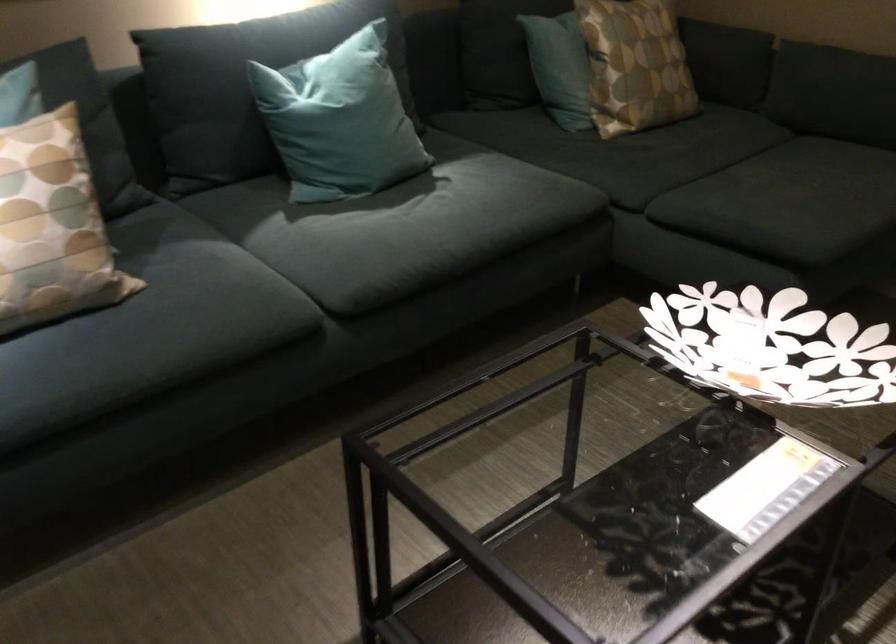
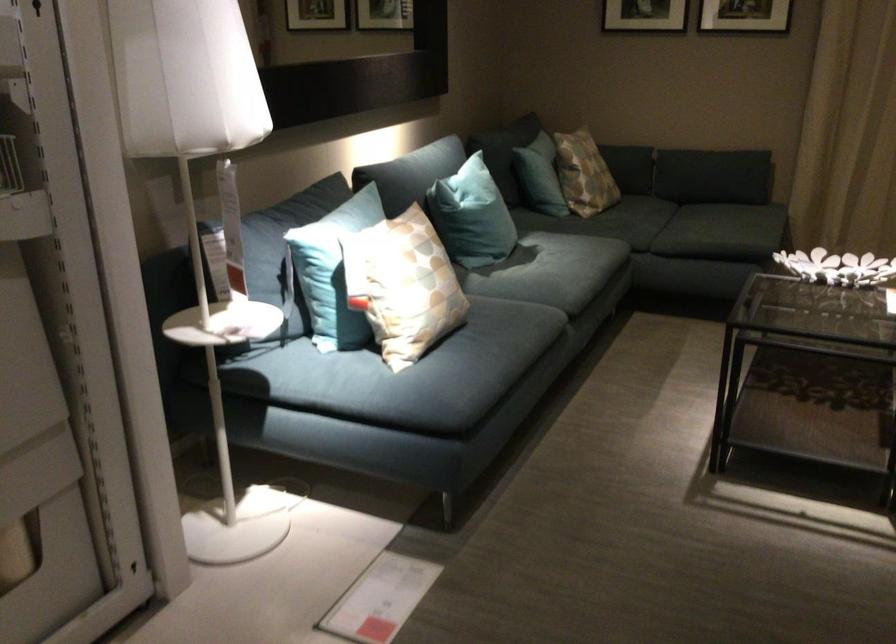
Locate, in the second image, the point that corresponds to pixel 352 243 in the first image.

(552, 275)